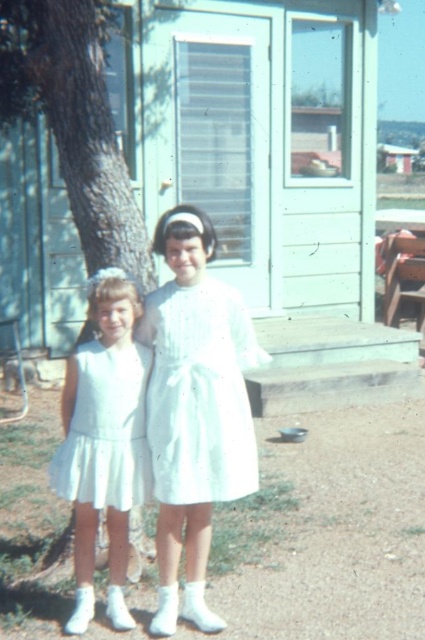
Can you confirm if white satin dress at center is wider than white satin dress at left?

Incorrect, white satin dress at center's width does not surpass white satin dress at left's.

Describe the element at coordinates (104, 440) in the screenshot. The image size is (425, 640). I see `white satin dress at center` at that location.

Which is in front, point (135, 456) or point (125, 470)?

Point (125, 470) is in front.

You are a GUI agent. You are given a task and a screenshot of the screen. Output one action in this format:
    pyautogui.click(x=<x>, y=<y>)
    Task: Click on the white satin dress at center
    The image size is (425, 640).
    Given the screenshot: What is the action you would take?
    pyautogui.click(x=104, y=440)

Who is taller, green textured tree trunk at left or white pleated dress at center?

With more height is green textured tree trunk at left.

Which is more to the right, green textured tree trunk at left or white pleated dress at center?

white pleated dress at center is more to the right.

Describe the element at coordinates (74, 120) in the screenshot. I see `green textured tree trunk at left` at that location.

This screenshot has height=640, width=425. Find the location of `green textured tree trunk at left`. green textured tree trunk at left is located at coordinates (74, 120).

Consider the image. Between green textured tree trunk at left and white satin dress at left, which one has less height?

With less height is white satin dress at left.

Is point (105, 131) in front of point (96, 412)?

That is False.

Identify the location of green textured tree trunk at left. The image size is (425, 640). (74, 120).

The image size is (425, 640). In order to click on green textured tree trunk at left in this screenshot , I will do `click(74, 120)`.